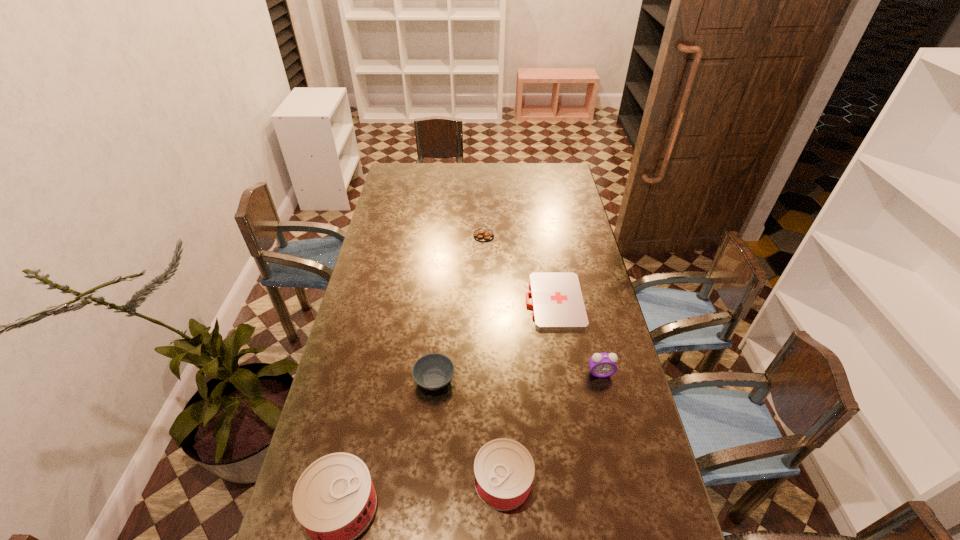
Considering the uniform spacing of cans, where should an additional can be positioned on the right? Please locate a free spot. Please provide its 2D coordinates. Your answer should be formatted as a tuple, i.e. [(x, y)], where the tuple contains the x and y coordinates of a point satisfying the conditions above.

[(653, 458)]